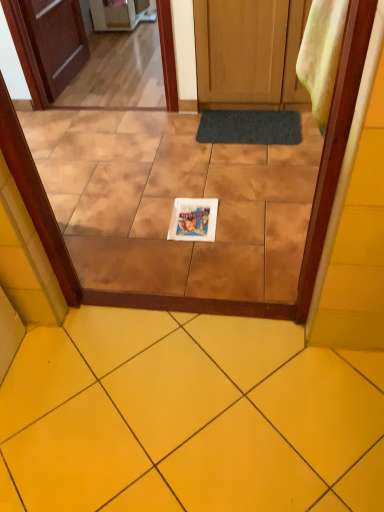
I want to click on free location to the right of white glossy magazine at center, so click(246, 222).